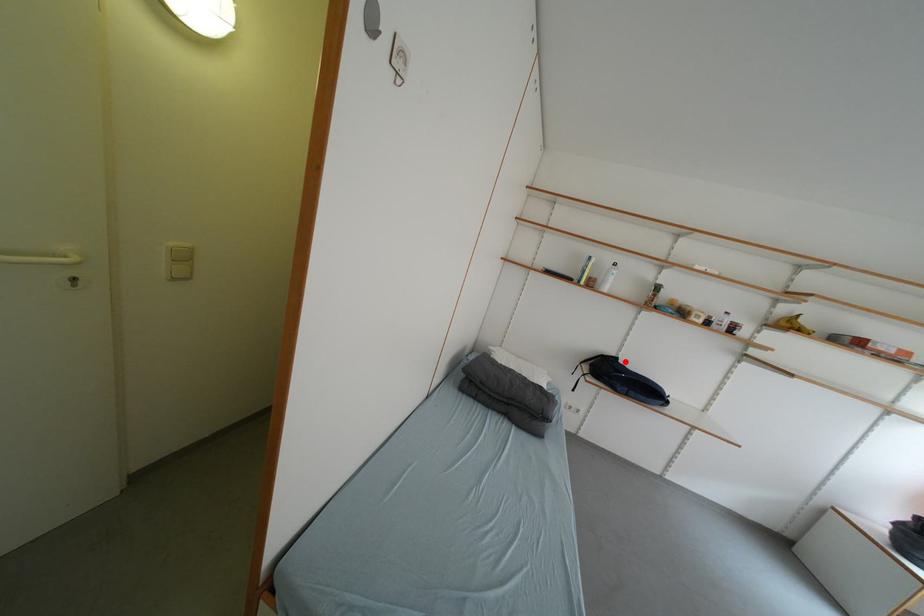
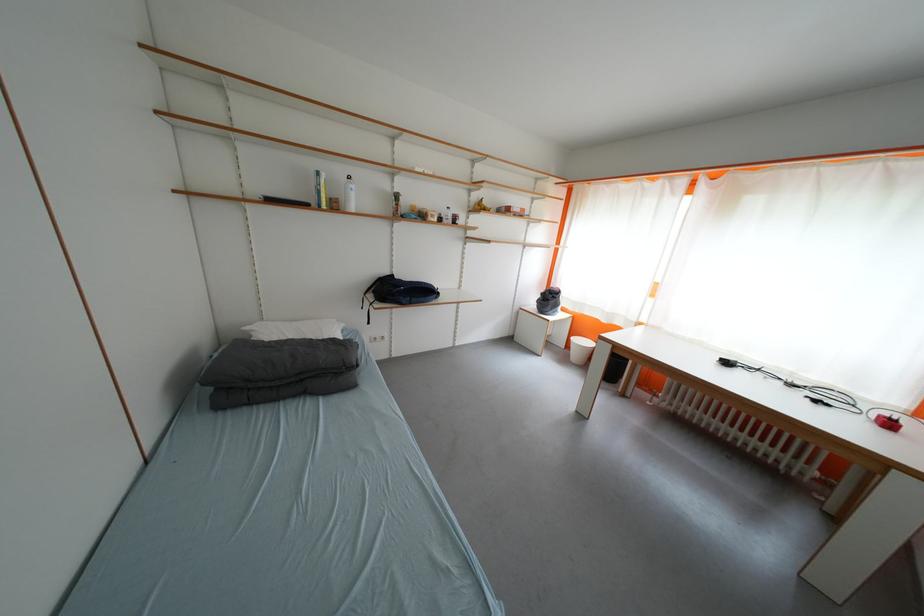
In the second image, find the point that corresponds to the highlighted location in the first image.

(400, 278)